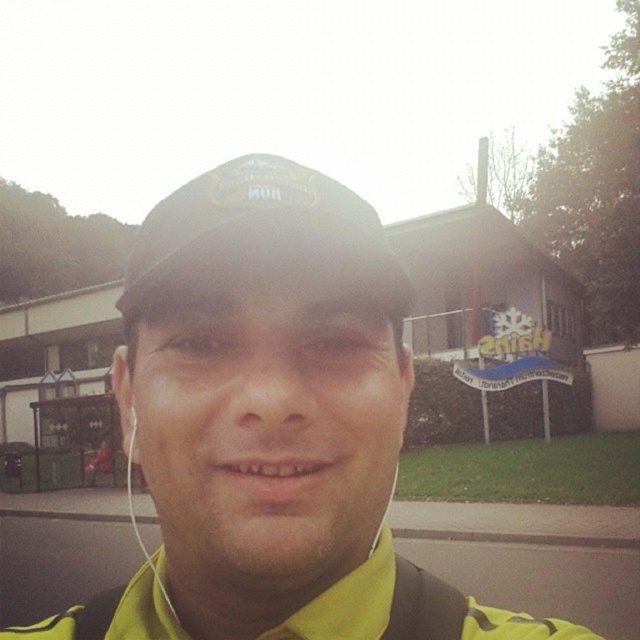
You are a photographer trying to capture the person in the image. The yellow matte jacket at center and the black fabric cap at center are both in focus. Which object is positioned closer to the camera?

The yellow matte jacket at center is closer to the viewer than the black fabric cap at center, so it would be the object positioned closer to the camera.

You are a photographer trying to capture the person in the image. You notice the black fabric cap at center and the white earphone at left. Which object should you focus on first if you want to capture both in a single frame without moving the camera?

The white earphone at left should be focused on first since the black fabric cap at center is to the right of it, ensuring both are within the frame when starting from the left side.

You are standing in front of the Znich building and want to take a photo of the point at coordinates (104,598). If your camera has a focal length of 50mm, what is the approximate distance in meters between you and the point?

The distance between the camera and the point is 53.88 centimeters, so you are approximately 0.54 meters away from the point.